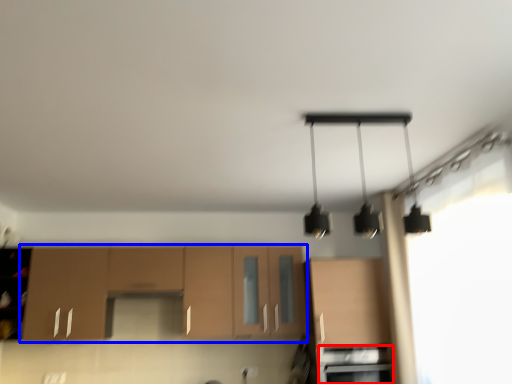
Question: Which object appears farthest to the camera in this image, oven (highlighted by a red box) or cabinetry (highlighted by a blue box)?

Choices:
 (A) oven
 (B) cabinetry

Answer: (B)